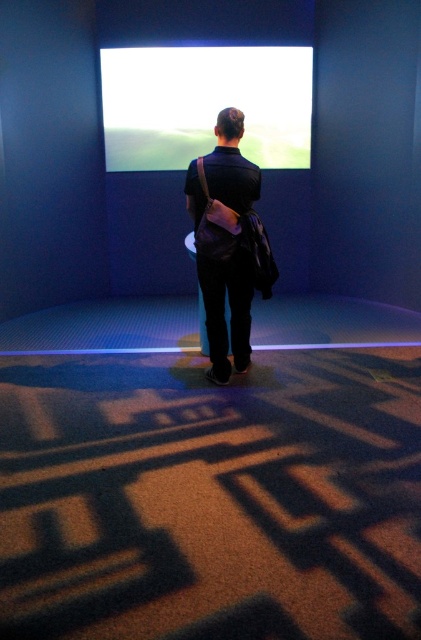
Question: Can you confirm if white glossy screen at upper center is positioned to the left of matte black backpack at center?

Choices:
 (A) yes
 (B) no

Answer: (A)

Question: Which point is closer to the camera?

Choices:
 (A) (250, 289)
 (B) (164, 52)

Answer: (A)

Question: Observing the image, what is the correct spatial positioning of white glossy screen at upper center in reference to matte black backpack at center?

Choices:
 (A) above
 (B) below

Answer: (A)

Question: Which point is farther to the camera?

Choices:
 (A) matte black backpack at center
 (B) white glossy screen at upper center

Answer: (B)

Question: Does white glossy screen at upper center lie in front of matte black backpack at center?

Choices:
 (A) no
 (B) yes

Answer: (A)